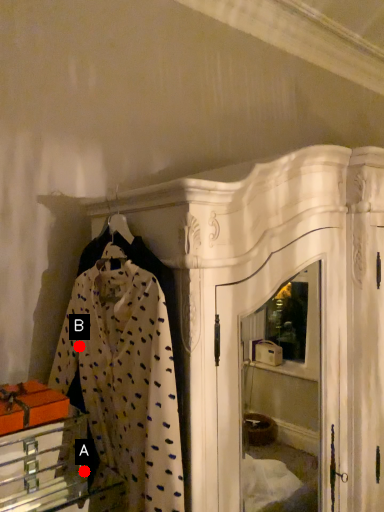
Question: Two points are circled on the image, labeled by A and B beside each circle. Which point is farther from the camera taking this photo?

Choices:
 (A) A is further
 (B) B is further

Answer: (B)